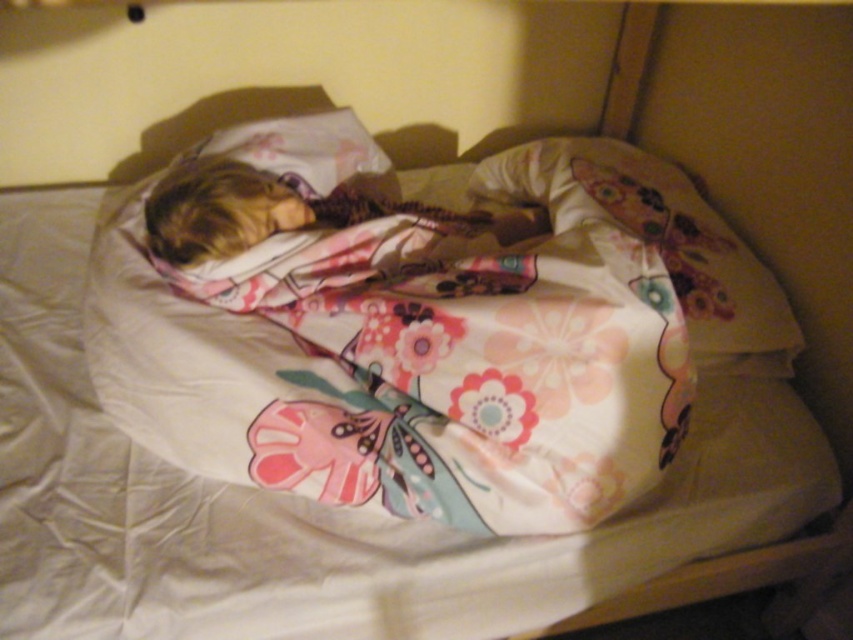
You are a parent standing at the edge of the bed and want to gently shake the floral fabric pillow at center to wake up your child. Can you reach it without moving closer to the bed?

The floral fabric pillow at center is 1.03 meters from the viewer, so if the parent can reach 1.03 meters, they can do so without moving closer. However, typical arm reach is about 1 meter, so they might need to lean slightly forward or move a tiny bit closer.

You are a photographer trying to capture a closeup of the floral fabric blanket at center. The camera you are using has a minimum focusing distance of 36 inches. Based on the scene, can you successfully take the photo without moving the blanket?

The distance between the floral fabric blanket at center and the camera is 36.95 inches, which is slightly more than the minimum focusing distance of 36 inches. Therefore, the photographer can successfully take the closeup without moving the blanket.